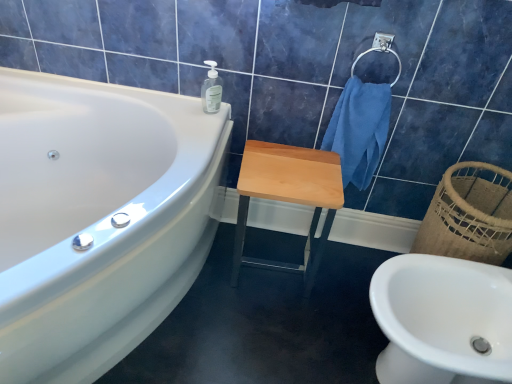
I want to click on vacant space that is to the left of transparent plastic soap dispenser at upper center, so click(175, 104).